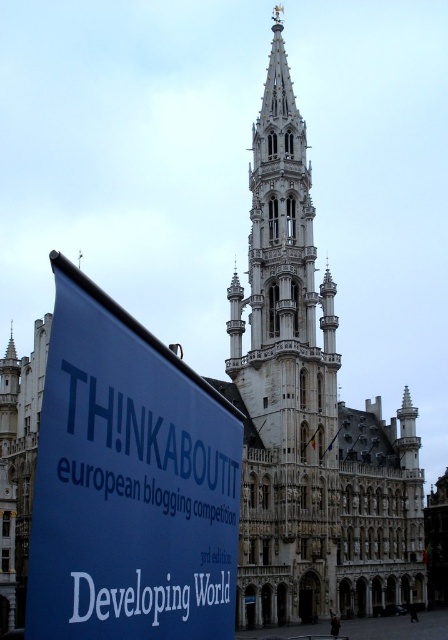
Can you confirm if blue fabric banner at lower left is taller than white stone tower at center?

No, blue fabric banner at lower left is not taller than white stone tower at center.

Based on the photo, who is positioned more to the left, blue fabric banner at lower left or white stone tower at center?

From the viewer's perspective, blue fabric banner at lower left appears more on the left side.

Is point (189, 488) in front of point (335, 410)?

Yes, point (189, 488) is in front of point (335, 410).

Where is `blue fabric banner at lower left`? Image resolution: width=448 pixels, height=640 pixels. blue fabric banner at lower left is located at coordinates (129, 483).